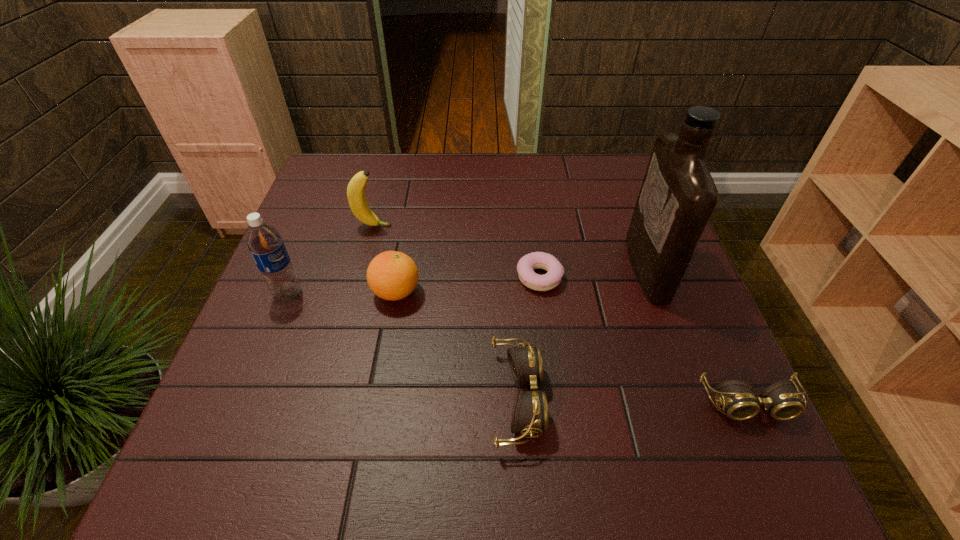
What are the coordinates of `free space that is in between the liquor and the doughnut` in the screenshot? It's located at (593, 273).

Locate an element on the screen. empty space between the liquor and the shorter goggles is located at coordinates (698, 336).

This screenshot has width=960, height=540. I want to click on vacant point located between the farthest object and the liquor, so pos(510,247).

Find the location of a particular element. Image resolution: width=960 pixels, height=540 pixels. empty space between the shorter goggles and the third shortest object is located at coordinates (634, 401).

I want to click on vacant space that's between the sixth tallest object and the left goggles, so click(634, 401).

Locate an element on the screen. Image resolution: width=960 pixels, height=540 pixels. free space between the shorter goggles and the orange is located at coordinates (572, 348).

Choose which object is the second nearest neighbor to the liquor. Please provide its 2D coordinates. Your answer should be formatted as a tuple, i.e. [(x, y)], where the tuple contains the x and y coordinates of a point satisfying the conditions above.

[(781, 400)]

Select which object is the fifth closest to the right goggles. Please provide its 2D coordinates. Your answer should be formatted as a tuple, i.e. [(x, y)], where the tuple contains the x and y coordinates of a point satisfying the conditions above.

[(356, 196)]